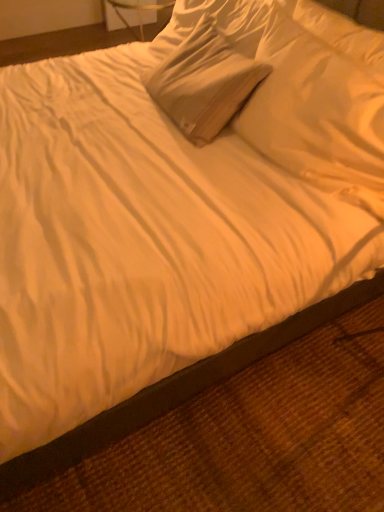
Question: Considering the positions of point (230, 45) and point (306, 91), is point (230, 45) closer or farther from the camera than point (306, 91)?

Choices:
 (A) closer
 (B) farther

Answer: (B)

Question: Based on their positions, is white soft pillow at upper center, marked as the first pillow in a left-to-right arrangement, located to the left or right of white soft pillow at upper center, the 2th pillow viewed from the left?

Choices:
 (A) left
 (B) right

Answer: (A)

Question: From a real-world perspective, relative to white soft pillow at upper center, the 2th pillow viewed from the left, is white soft pillow at upper center, marked as the first pillow in a left-to-right arrangement, vertically above or below?

Choices:
 (A) below
 (B) above

Answer: (A)

Question: In terms of size, does white soft pillow at upper center, positioned as the 1th pillow in right-to-left order, appear bigger or smaller than white soft pillow at upper center, the second pillow in the right-to-left sequence?

Choices:
 (A) big
 (B) small

Answer: (B)

Question: From the image's perspective, is white soft pillow at upper center, the 2th pillow viewed from the left, located above or below white soft pillow at upper center, the second pillow in the right-to-left sequence?

Choices:
 (A) above
 (B) below

Answer: (B)

Question: From a real-world perspective, is white soft pillow at upper center, the 2th pillow viewed from the left, positioned above or below white soft pillow at upper center, marked as the first pillow in a left-to-right arrangement?

Choices:
 (A) above
 (B) below

Answer: (A)

Question: Looking at their shapes, would you say white soft pillow at upper center, positioned as the 1th pillow in right-to-left order, is wider or thinner than white soft pillow at upper center, marked as the first pillow in a left-to-right arrangement?

Choices:
 (A) thin
 (B) wide

Answer: (A)